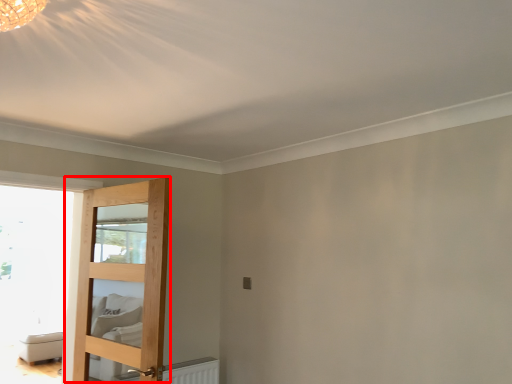
Question: From the image, what is the correct spatial relationship of door (annotated by the red box) in relation to furniture?

Choices:
 (A) right
 (B) left

Answer: (A)